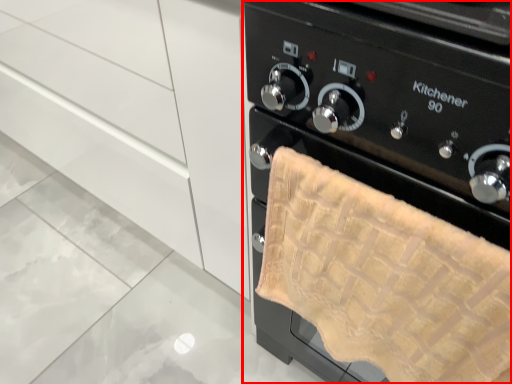
Question: From the image's perspective, what is the correct spatial positioning of home appliance (annotated by the red box) in reference to cabinetry?

Choices:
 (A) above
 (B) below

Answer: (B)